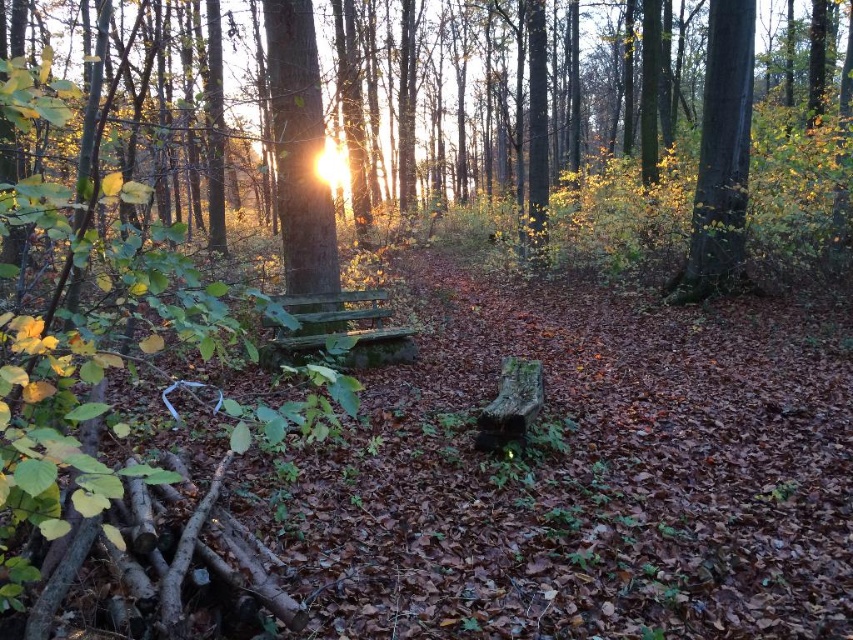
Question: Is brown wood bench at center positioned at the back of green mossy bench at center?

Choices:
 (A) yes
 (B) no

Answer: (B)

Question: Estimate the real-world distances between objects in this image. Which object is farther from the green mossy bench at center?

Choices:
 (A) smooth bark tree at upper right
 (B) brown wood bench at center
 (C) smooth brown tree trunk at center

Answer: (B)

Question: Which of the following is the farthest from the observer?

Choices:
 (A) smooth brown tree trunk at center
 (B) smooth bark tree at upper right
 (C) green mossy bench at center

Answer: (B)

Question: Is smooth brown tree trunk at center to the right of green mossy bench at center from the viewer's perspective?

Choices:
 (A) yes
 (B) no

Answer: (B)

Question: Which is nearer to the smooth brown tree trunk at center?

Choices:
 (A) smooth bark tree at upper right
 (B) green mossy bench at center

Answer: (B)

Question: In this image, where is smooth brown tree trunk at center located relative to smooth bark tree at upper right?

Choices:
 (A) below
 (B) above

Answer: (A)